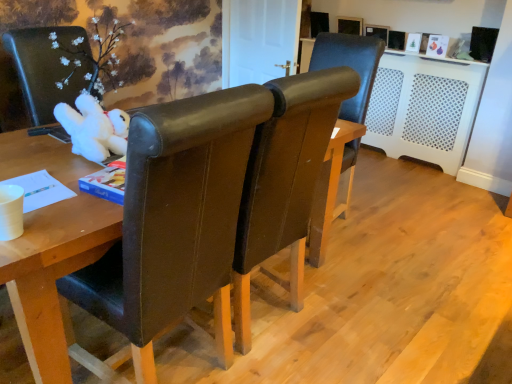
Locate an element on the screen. This screenshot has height=384, width=512. brown leather chair at center, the third chair positioned from the front is located at coordinates (350, 66).

Which of these two, white perforated plastic radiator at right or brown leather chair at center, the third chair positioned from the front, is thinner?

With smaller width is white perforated plastic radiator at right.

Between white perforated plastic radiator at right and brown leather chair at center, positioned as the first chair in back-to-front order, which one has smaller size?

Smaller between the two is brown leather chair at center, positioned as the first chair in back-to-front order.

From the image's perspective, which one is positioned higher, white perforated plastic radiator at right or brown leather chair at center, positioned as the first chair in back-to-front order?

white perforated plastic radiator at right, from the image's perspective.

From a real-world perspective, which is physically above, white perforated plastic radiator at right or brown leather chair at center, positioned as the first chair in back-to-front order?

brown leather chair at center, positioned as the first chair in back-to-front order, from a real-world perspective.

Locate an element on the screen. The height and width of the screenshot is (384, 512). computer desk on the right side of white plush toy at left is located at coordinates (424, 107).

Is white perforated plastic radiator at right wider than white plush toy at left?

Incorrect, the width of white perforated plastic radiator at right does not surpass that of white plush toy at left.

Is white perforated plastic radiator at right with white plush toy at left?

No, white perforated plastic radiator at right is not making contact with white plush toy at left.

Considering the relative positions of white plush toy at left and brown leather chair at center, the 3th chair positioned from the back, in the image provided, is white plush toy at left in front of brown leather chair at center, the 3th chair positioned from the back,?

No, white plush toy at left is further to the viewer.

From a real-world perspective, is white plush toy at left positioned above or below brown leather chair at center, acting as the first chair starting from the front?

Clearly, from a real-world perspective, white plush toy at left is above brown leather chair at center, acting as the first chair starting from the front.

Would you consider white plush toy at left to be distant from brown leather chair at center, acting as the first chair starting from the front?

No, white plush toy at left is not far from brown leather chair at center, acting as the first chair starting from the front.

Based on the photo, does white plush toy at left have a larger size compared to brown leather chair at center, the 3th chair positioned from the back?

Incorrect, white plush toy at left is not larger than brown leather chair at center, the 3th chair positioned from the back.

In the scene shown: Is brown leather chair at center, the 3th chair positioned from the back, next to brown leather chair at center, the third chair positioned from the front?

No, brown leather chair at center, the 3th chair positioned from the back, is not next to brown leather chair at center, the third chair positioned from the front.

Between brown leather chair at center, the 3th chair positioned from the back, and brown leather chair at center, the third chair positioned from the front, which one appears on the right side from the viewer's perspective?

From the viewer's perspective, brown leather chair at center, the third chair positioned from the front, appears more on the right side.

From the image's perspective, is brown leather chair at center, acting as the first chair starting from the front, above brown leather chair at center, the third chair positioned from the front?

No.

Identify the location of the 2nd chair in front of the brown leather chair at center, the third chair positioned from the front, counting from the anchor's position. This screenshot has width=512, height=384. (175, 220).

From the image's perspective, does brown leather chair at center, which is counted as the 2th chair, starting from the front, appear lower than white plush toy at left?

Yes.

From a real-world perspective, between brown leather chair at center, which is counted as the second chair, starting from the back, and white plush toy at left, who is vertically lower?

brown leather chair at center, which is counted as the second chair, starting from the back, from a real-world perspective.

Considering the points (282, 198) and (125, 152), which point is behind, point (282, 198) or point (125, 152)?

Positioned behind is point (282, 198).

Consider the image. Which object is thinner, brown leather chair at center, which is counted as the 2th chair, starting from the front, or white plush toy at left?

white plush toy at left is thinner.

Can you confirm if brown leather chair at center, which is counted as the second chair, starting from the back, is shorter than brown leather chair at center, positioned as the first chair in back-to-front order?

No.

Find the location of `chair below the brown leather chair at center, which is counted as the second chair, starting from the back (from a real-world perspective)`. chair below the brown leather chair at center, which is counted as the second chair, starting from the back (from a real-world perspective) is located at coordinates (350, 66).

Considering the positions of objects brown leather chair at center, which is counted as the second chair, starting from the back, and brown leather chair at center, positioned as the first chair in back-to-front order, in the image provided, who is more to the left, brown leather chair at center, which is counted as the second chair, starting from the back, or brown leather chair at center, positioned as the first chair in back-to-front order,?

brown leather chair at center, which is counted as the second chair, starting from the back, is more to the left.

Between white perforated plastic radiator at right and brown leather chair at center, which is counted as the second chair, starting from the back, which one appears on the right side from the viewer's perspective?

Positioned to the right is white perforated plastic radiator at right.

Are white perforated plastic radiator at right and brown leather chair at center, which is counted as the second chair, starting from the back, located far from each other?

Yes, white perforated plastic radiator at right and brown leather chair at center, which is counted as the second chair, starting from the back, are located far from each other.

Which of these two, white perforated plastic radiator at right or brown leather chair at center, which is counted as the second chair, starting from the back, is bigger?

With larger size is brown leather chair at center, which is counted as the second chair, starting from the back.

From a real-world perspective, count 2nd chairs upward from the white perforated plastic radiator at right and point to it. Please provide its 2D coordinates.

[(285, 180)]

Identify the location of chair that is the 1st object to the left of the white perforated plastic radiator at right, starting at the anchor. (350, 66).

Where is `toy above the white perforated plastic radiator at right (from a real-world perspective)`? Image resolution: width=512 pixels, height=384 pixels. toy above the white perforated plastic radiator at right (from a real-world perspective) is located at coordinates (94, 128).

From the image, which object appears to be farther from brown leather chair at center, which is counted as the 2th chair, starting from the front, brown leather chair at center, the 3th chair positioned from the back, or brown leather chair at center, the third chair positioned from the front?

brown leather chair at center, the third chair positioned from the front, lies further to brown leather chair at center, which is counted as the 2th chair, starting from the front, than the other object.

From the picture: From the image, which object appears to be farther from brown leather chair at center, which is counted as the 2th chair, starting from the front, brown leather chair at center, the third chair positioned from the front, or brown leather chair at center, acting as the first chair starting from the front?

The object further to brown leather chair at center, which is counted as the 2th chair, starting from the front, is brown leather chair at center, the third chair positioned from the front.

Considering their positions, is brown leather chair at center, positioned as the first chair in back-to-front order, positioned further to white perforated plastic radiator at right than brown leather chair at center, the 3th chair positioned from the back?

brown leather chair at center, the 3th chair positioned from the back, is positioned further to the anchor white perforated plastic radiator at right.

Looking at the image, which one is located closer to brown leather chair at center, which is counted as the 2th chair, starting from the front, white perforated plastic radiator at right or brown leather chair at center, the third chair positioned from the front?

brown leather chair at center, the third chair positioned from the front, is closer to brown leather chair at center, which is counted as the 2th chair, starting from the front.

Considering their positions, is white plush toy at left positioned further to brown leather chair at center, which is counted as the second chair, starting from the back, than white perforated plastic radiator at right?

white perforated plastic radiator at right lies further to brown leather chair at center, which is counted as the second chair, starting from the back, than the other object.

From the image, which object appears to be nearer to white plush toy at left, brown leather chair at center, the 3th chair positioned from the back, or white perforated plastic radiator at right?

The object closer to white plush toy at left is brown leather chair at center, the 3th chair positioned from the back.

When comparing their distances from brown leather chair at center, which is counted as the second chair, starting from the back, does white perforated plastic radiator at right or brown leather chair at center, acting as the first chair starting from the front, seem closer?

The object closer to brown leather chair at center, which is counted as the second chair, starting from the back, is brown leather chair at center, acting as the first chair starting from the front.

From the image, which object appears to be nearer to brown leather chair at center, the 3th chair positioned from the back, white perforated plastic radiator at right or brown leather chair at center, which is counted as the second chair, starting from the back?

Among the two, brown leather chair at center, which is counted as the second chair, starting from the back, is located nearer to brown leather chair at center, the 3th chair positioned from the back.

Where is `chair situated between white plush toy at left and brown leather chair at center, which is counted as the second chair, starting from the back, from left to right`? This screenshot has height=384, width=512. chair situated between white plush toy at left and brown leather chair at center, which is counted as the second chair, starting from the back, from left to right is located at coordinates (175, 220).

The width and height of the screenshot is (512, 384). Identify the location of chair positioned between white plush toy at left and white perforated plastic radiator at right from near to far. (350, 66).

Image resolution: width=512 pixels, height=384 pixels. What are the coordinates of `toy located between brown leather chair at center, the 3th chair positioned from the back, and brown leather chair at center, positioned as the first chair in back-to-front order, in the depth direction` in the screenshot? It's located at (94, 128).

You are a GUI agent. You are given a task and a screenshot of the screen. Output one action in this format:
    pyautogui.click(x=<x>, y=<y>)
    Task: Click on the chair positioned between brown leather chair at center, the 3th chair positioned from the back, and brown leather chair at center, positioned as the first chair in back-to-front order, from near to far
    
    Given the screenshot: What is the action you would take?
    pyautogui.click(x=285, y=180)